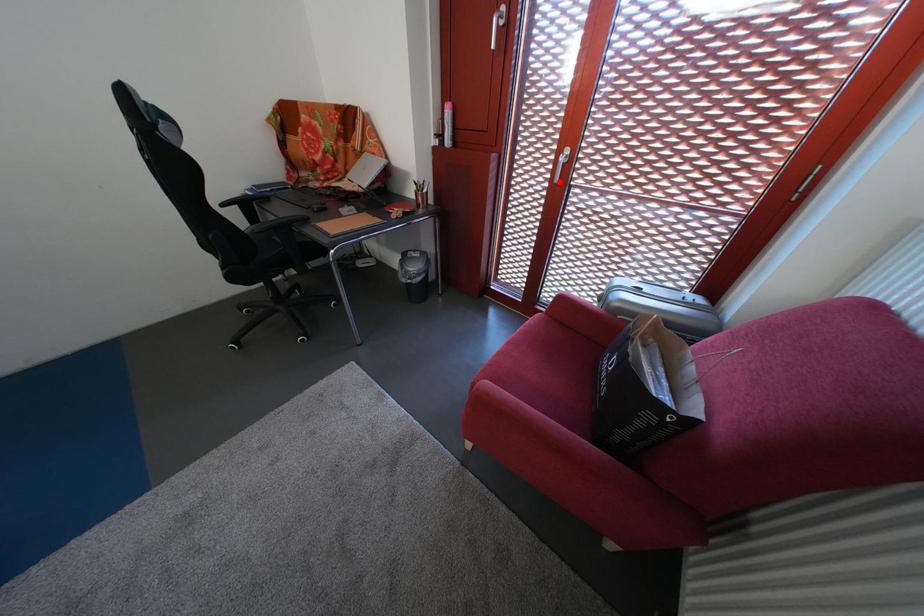
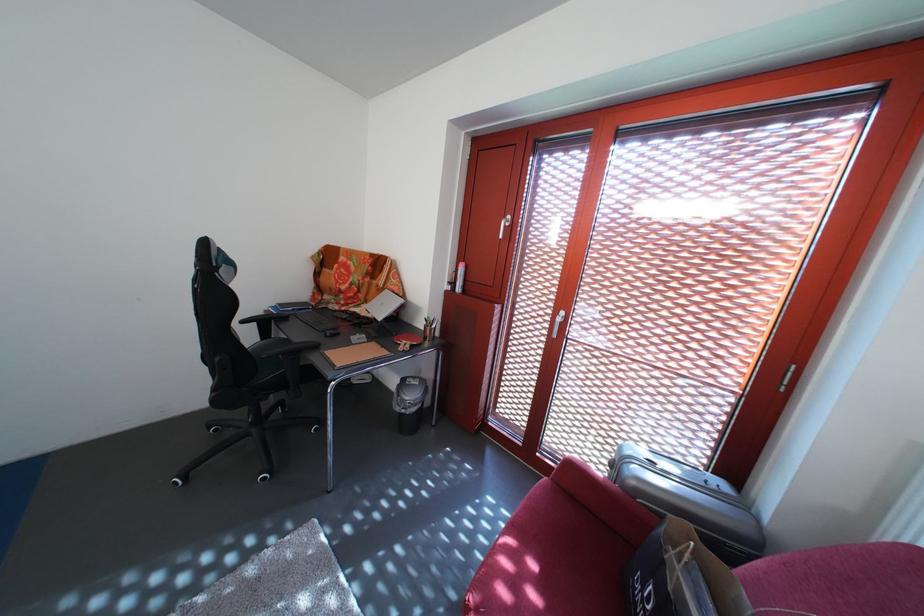
Locate, in the second image, the point that corresponds to the highlighted location in the first image.

(556, 331)